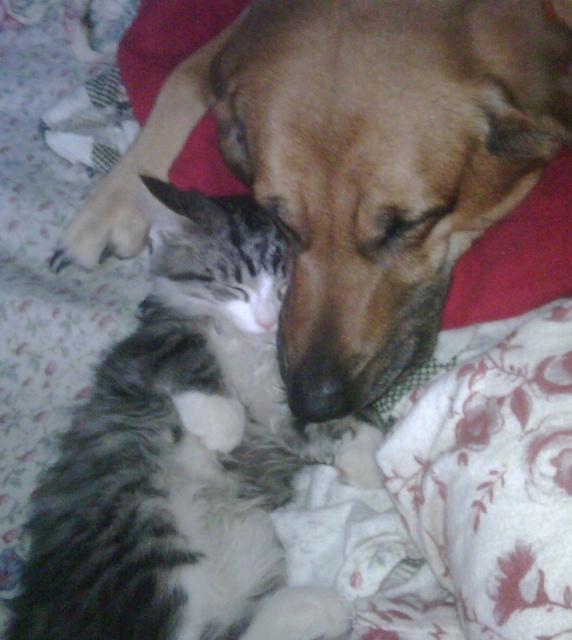
Question: Does brown matte dog at center have a lesser width compared to tabby fur cat at center?

Choices:
 (A) no
 (B) yes

Answer: (A)

Question: Does brown matte dog at center have a larger size compared to tabby fur cat at center?

Choices:
 (A) yes
 (B) no

Answer: (A)

Question: Which point appears farthest from the camera in this image?

Choices:
 (A) (219, 353)
 (B) (452, 157)

Answer: (A)

Question: Does brown matte dog at center have a greater width compared to tabby fur cat at center?

Choices:
 (A) yes
 (B) no

Answer: (A)

Question: Which point is closer to the camera taking this photo?

Choices:
 (A) (374, 352)
 (B) (143, 570)

Answer: (B)